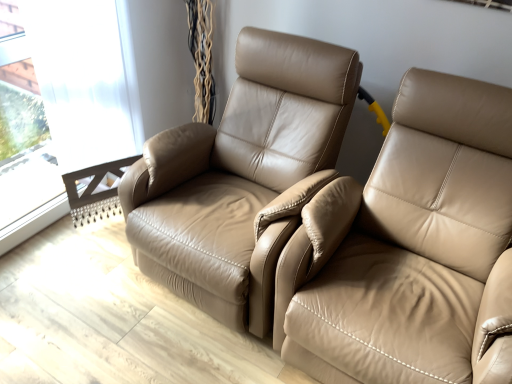
Question: From a real-world perspective, is beige leather recliner at right below transparent glass window at upper left?

Choices:
 (A) no
 (B) yes

Answer: (B)

Question: From the image's perspective, is beige leather recliner at right above transparent glass window at upper left?

Choices:
 (A) yes
 (B) no

Answer: (B)

Question: Can you confirm if beige leather recliner at right is wider than transparent glass window at upper left?

Choices:
 (A) yes
 (B) no

Answer: (A)

Question: Considering the relative sizes of beige leather recliner at right and transparent glass window at upper left in the image provided, is beige leather recliner at right smaller than transparent glass window at upper left?

Choices:
 (A) yes
 (B) no

Answer: (B)

Question: Can you confirm if beige leather recliner at right is thinner than transparent glass window at upper left?

Choices:
 (A) no
 (B) yes

Answer: (A)

Question: In terms of height, does tan leather chair at center look taller or shorter compared to beige leather recliner at right?

Choices:
 (A) tall
 (B) short

Answer: (B)

Question: Is tan leather chair at center inside the boundaries of beige leather recliner at right, or outside?

Choices:
 (A) outside
 (B) inside

Answer: (A)

Question: Relative to beige leather recliner at right, is tan leather chair at center in front or behind?

Choices:
 (A) front
 (B) behind

Answer: (B)

Question: Would you say tan leather chair at center is to the left or to the right of beige leather recliner at right in the picture?

Choices:
 (A) right
 (B) left

Answer: (B)

Question: Considering the positions of tan leather chair at center and transparent glass window at upper left in the image, is tan leather chair at center bigger or smaller than transparent glass window at upper left?

Choices:
 (A) big
 (B) small

Answer: (A)

Question: From the image's perspective, is tan leather chair at center positioned above or below transparent glass window at upper left?

Choices:
 (A) above
 (B) below

Answer: (B)

Question: Would you say tan leather chair at center is to the left or to the right of transparent glass window at upper left in the picture?

Choices:
 (A) right
 (B) left

Answer: (A)

Question: Relative to transparent glass window at upper left, is tan leather chair at center in front or behind?

Choices:
 (A) front
 (B) behind

Answer: (A)

Question: In terms of size, does transparent glass window at upper left appear bigger or smaller than beige leather recliner at right?

Choices:
 (A) small
 (B) big

Answer: (A)

Question: Based on their positions, is transparent glass window at upper left located to the left or right of beige leather recliner at right?

Choices:
 (A) right
 (B) left

Answer: (B)